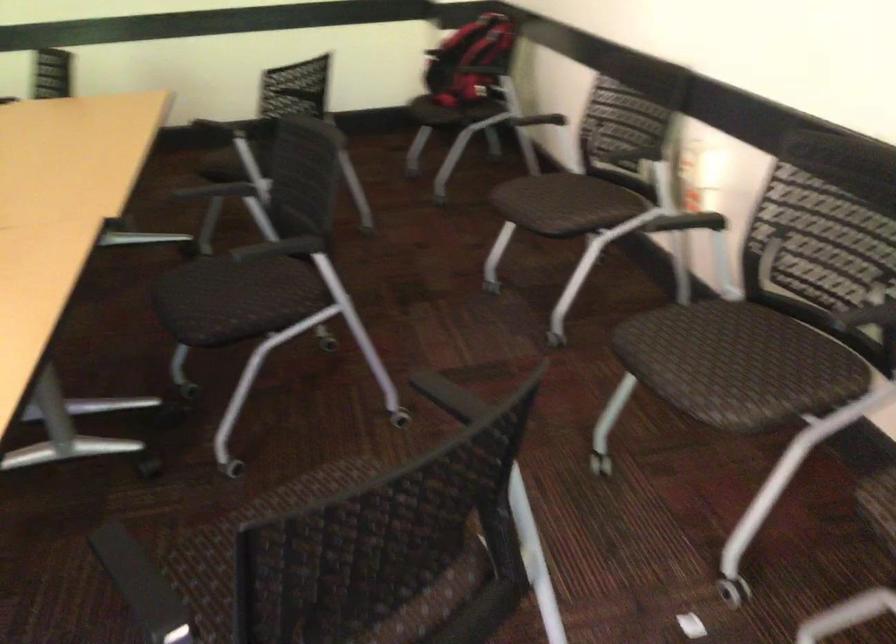
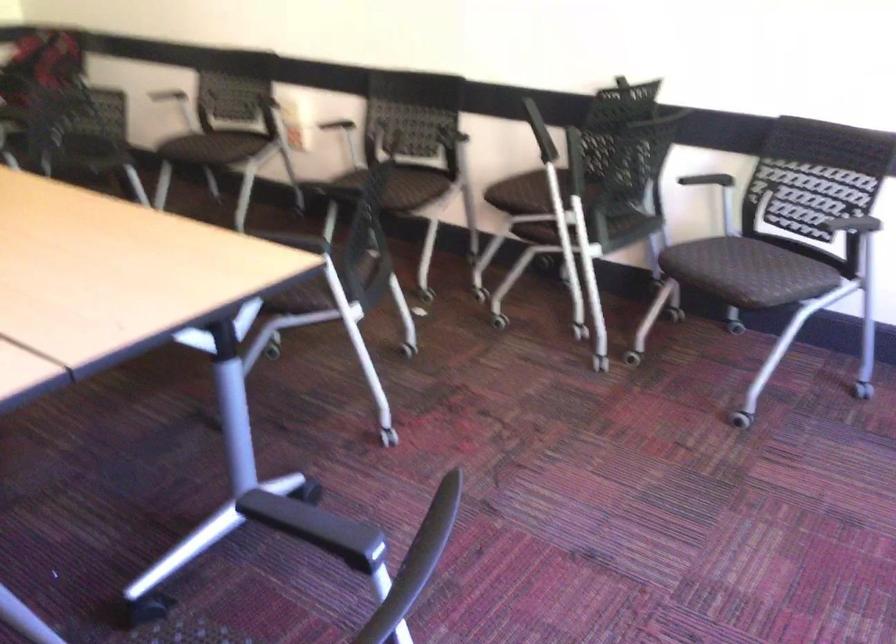
Locate, in the second image, the point that corresponds to the point at 736,388 in the first image.

(402, 187)